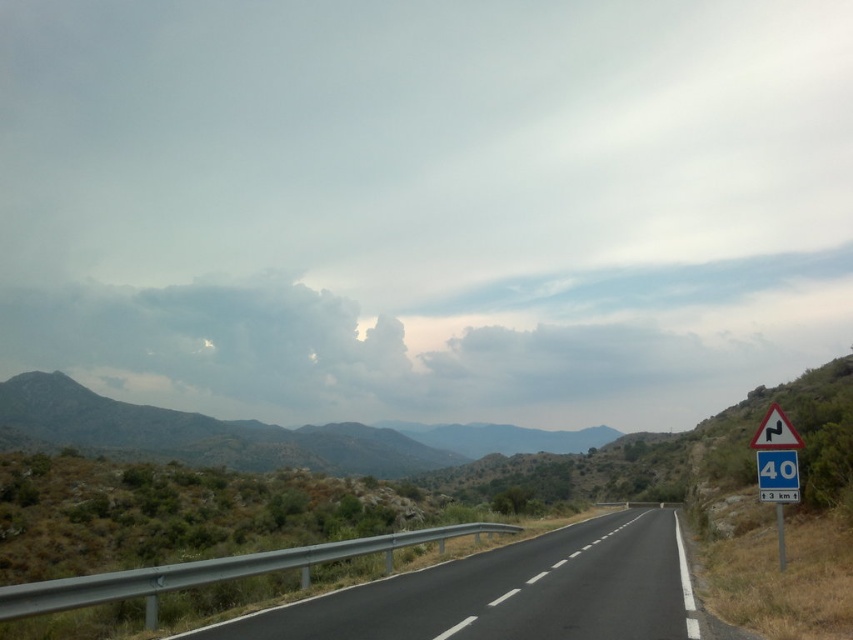
Question: Can you confirm if white plastic triangular sign at right is smaller than blue plastic speed limit sign at right?

Choices:
 (A) yes
 (B) no

Answer: (A)

Question: Does gray fluffy cloud at upper center lie in front of white plastic triangular sign at right?

Choices:
 (A) no
 (B) yes

Answer: (A)

Question: From the image, what is the correct spatial relationship of black asphalt road at center in relation to green textured hillside at center?

Choices:
 (A) left
 (B) right

Answer: (B)

Question: Which of the following is the closest to the observer?

Choices:
 (A) blue plastic speed limit sign at right
 (B) white plastic triangle at right
 (C) green textured hillside at center

Answer: (B)

Question: Which point is farther to the camera?

Choices:
 (A) (769, 442)
 (B) (791, 451)
 (C) (694, 289)

Answer: (C)

Question: Which point is farther from the camera taking this photo?

Choices:
 (A) (791, 445)
 (B) (293, 618)
 (C) (453, 355)

Answer: (C)